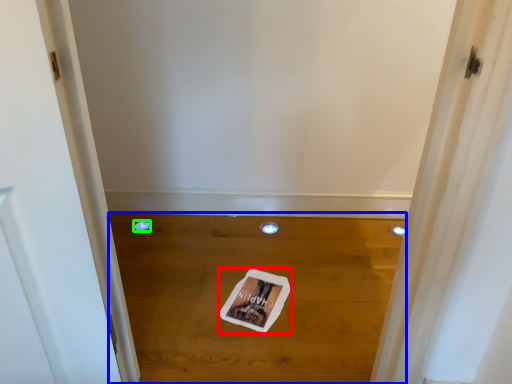
Question: Considering the real-world distances, which object is closest to magazine (highlighted by a red box)? plain (highlighted by a blue box) or hole (highlighted by a green box).

Choices:
 (A) plain
 (B) hole

Answer: (A)